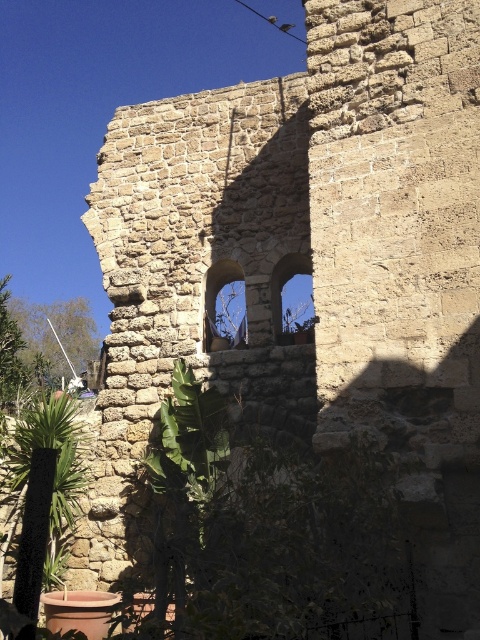
Question: Which point appears closest to the camera in this image?

Choices:
 (A) 215,269
 (B) 26,422

Answer: (B)

Question: Can you confirm if green leafy plant at lower left is positioned to the right of stone window at center?

Choices:
 (A) yes
 (B) no

Answer: (B)

Question: Observing the image, what is the correct spatial positioning of green leafy plant at lower left in reference to transparent glass window at upper center?

Choices:
 (A) right
 (B) left

Answer: (B)

Question: Estimate the real-world distances between objects in this image. Which object is closer to the stone window at center?

Choices:
 (A) green leafy plant at lower left
 (B) transparent glass window at upper center

Answer: (B)

Question: Does stone window at center lie behind transparent glass window at upper center?

Choices:
 (A) yes
 (B) no

Answer: (A)

Question: Which is nearer to the transparent glass window at upper center?

Choices:
 (A) green leafy plant at lower left
 (B) stone window at center

Answer: (B)